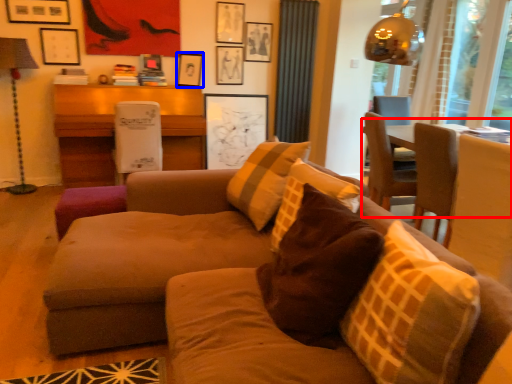
Question: Among these objects, which one is farthest to the camera, table (highlighted by a red box) or picture frame (highlighted by a blue box)?

Choices:
 (A) table
 (B) picture frame

Answer: (B)